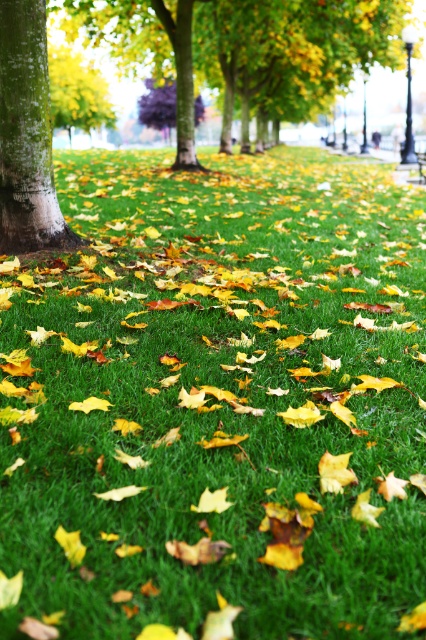
Who is more distant from viewer, (28, 17) or (154, 90)?

The point (154, 90) is more distant.

Is point (8, 211) positioned behind point (173, 124)?

No, (8, 211) is closer to viewer.

This screenshot has height=640, width=426. What are the coordinates of `smooth white tree trunk at left` in the screenshot? It's located at (26, 134).

Who is shorter, green rough bark tree at center or smooth white tree trunk at left?

With less height is green rough bark tree at center.

Is green rough bark tree at center smaller than smooth white tree trunk at left?

Incorrect, green rough bark tree at center is not smaller in size than smooth white tree trunk at left.

The height and width of the screenshot is (640, 426). What do you see at coordinates (25, 134) in the screenshot? I see `green rough bark tree at center` at bounding box center [25, 134].

The height and width of the screenshot is (640, 426). I want to click on green rough bark tree at center, so click(x=25, y=134).

Is green rough bark tree at center to the right of purple smooth tree at center from the viewer's perspective?

No, green rough bark tree at center is not to the right of purple smooth tree at center.

Does green rough bark tree at center have a greater width compared to purple smooth tree at center?

Correct, the width of green rough bark tree at center exceeds that of purple smooth tree at center.

Does point (2, 196) lie behind point (160, 122)?

No, it is in front of (160, 122).

Where is `green rough bark tree at center`? The image size is (426, 640). green rough bark tree at center is located at coordinates (25, 134).